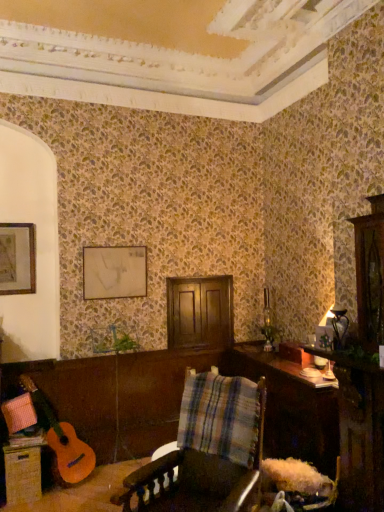
Question: From the image's perspective, does matte gold picture frame at upper left, the 2th picture frame positioned from the back, appear lower than wooden table at lower right?

Choices:
 (A) no
 (B) yes

Answer: (A)

Question: Could wooden table at lower right be considered to be inside matte gold picture frame at upper left, arranged as the 1th picture frame when viewed from the front?

Choices:
 (A) yes
 (B) no

Answer: (B)

Question: Can you confirm if matte gold picture frame at upper left, positioned as the 2th picture frame in right-to-left order, is positioned to the left of wooden table at lower right?

Choices:
 (A) yes
 (B) no

Answer: (A)

Question: Is matte gold picture frame at upper left, the first picture frame positioned from the left, to the right of wooden table at lower right from the viewer's perspective?

Choices:
 (A) no
 (B) yes

Answer: (A)

Question: Considering the relative sizes of matte gold picture frame at upper left, positioned as the 2th picture frame in right-to-left order, and wooden table at lower right in the image provided, is matte gold picture frame at upper left, positioned as the 2th picture frame in right-to-left order, smaller than wooden table at lower right?

Choices:
 (A) yes
 (B) no

Answer: (A)

Question: Is matte gold picture frame at upper left, the 2th picture frame positioned from the back, with wooden table at lower right?

Choices:
 (A) yes
 (B) no

Answer: (B)

Question: Can you confirm if matte gold picture frame at upper left, positioned as the 2th picture frame in right-to-left order, is positioned to the left of plaid fabric at center?

Choices:
 (A) no
 (B) yes

Answer: (B)

Question: Is matte gold picture frame at upper left, arranged as the 1th picture frame when viewed from the front, further to the viewer compared to plaid fabric at center?

Choices:
 (A) yes
 (B) no

Answer: (A)

Question: Does matte gold picture frame at upper left, the 2th picture frame positioned from the back, have a greater height compared to plaid fabric at center?

Choices:
 (A) yes
 (B) no

Answer: (A)

Question: Is plaid fabric at center at the back of matte gold picture frame at upper left, positioned as the 2th picture frame in right-to-left order?

Choices:
 (A) no
 (B) yes

Answer: (A)

Question: Is the depth of matte gold picture frame at upper left, positioned as the 2th picture frame in right-to-left order, less than that of plaid fabric at center?

Choices:
 (A) no
 (B) yes

Answer: (A)

Question: Can you confirm if matte gold picture frame at upper left, the 2th picture frame positioned from the back, is smaller than plaid fabric at center?

Choices:
 (A) no
 (B) yes

Answer: (B)

Question: Is woven wicker drawer at lower left not within matte gold picture frame at upper left, positioned as the 2th picture frame in right-to-left order?

Choices:
 (A) no
 (B) yes

Answer: (B)